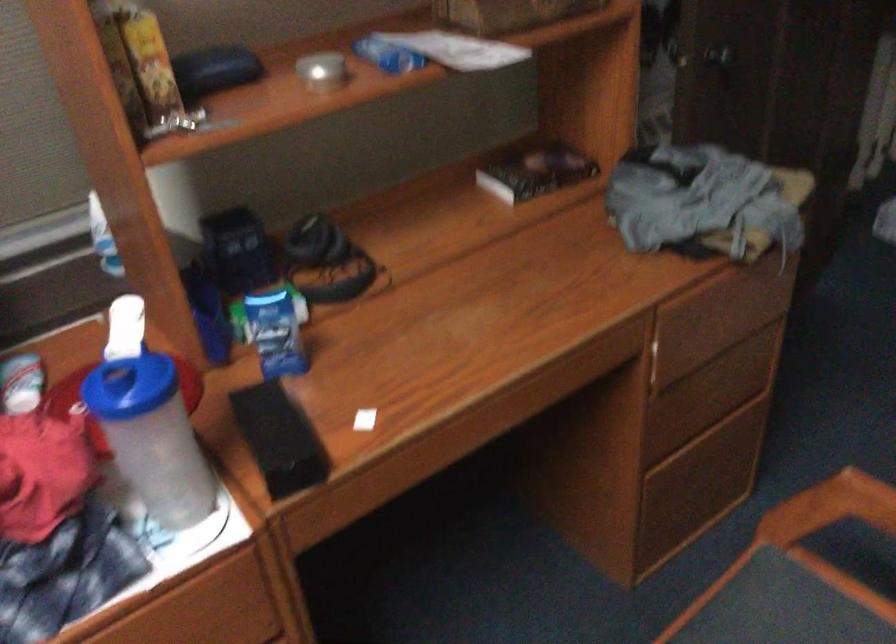
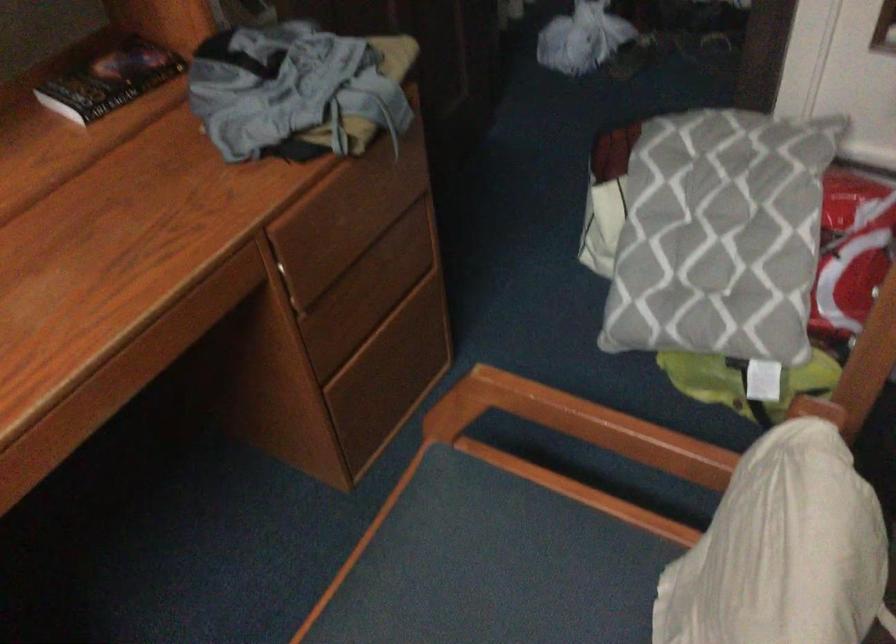
Question: The camera is either moving clockwise (left) or counter-clockwise (right) around the object. The first image is from the beginning of the video and the second image is from the end. Is the camera moving left or right when shooting the video?

Choices:
 (A) Left
 (B) Right

Answer: (A)